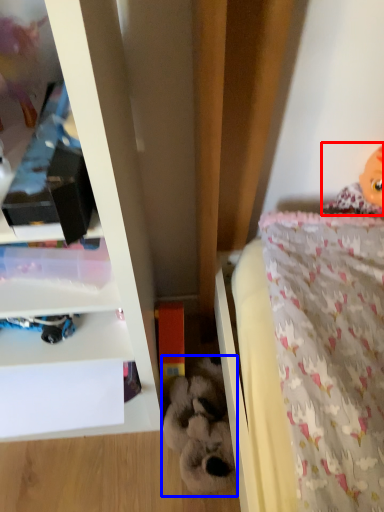
Question: Which point is further to the camera, doll (highlighted by a red box) or toy (highlighted by a blue box)?

Choices:
 (A) doll
 (B) toy

Answer: (B)